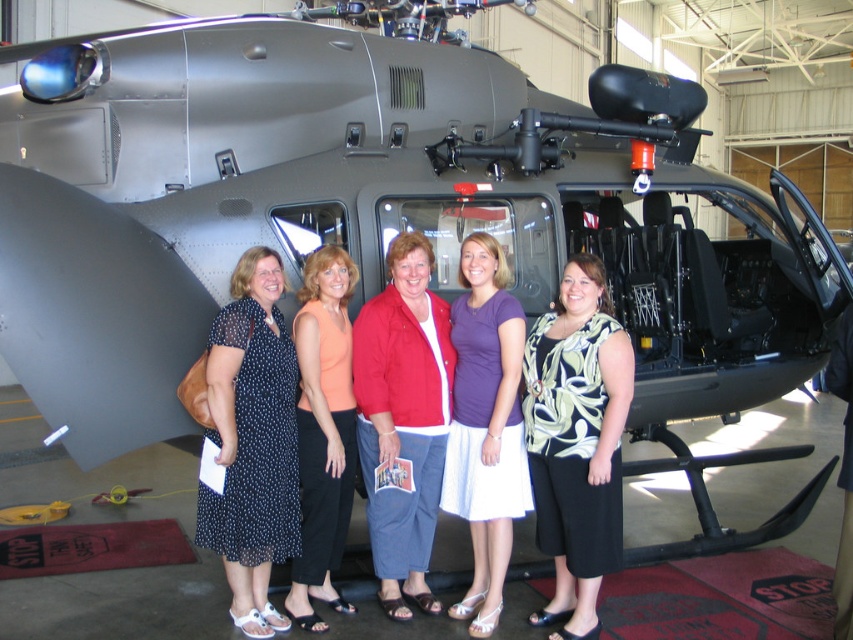
You are organizing a photoshoot and need to arrange the models so that the polka dot dress at center and orange fabric top at center are visible. Given their sizes, which model should be placed closer to the camera to ensure both are fully visible?

The polka dot dress at center is wider than the orange fabric top at center, so the orange fabric top at center should be placed closer to the camera to ensure both are fully visible.

You are standing in the hangar and want to find the polka dot dress at center. According to the coordinates provided, where should you look relative to the helicopter?

The polka dot dress at center is located at point coordinates, so you should look towards the center area of the image where the coordinates indicate its position relative to the helicopter.

You are a photographer setting up for a group photo in the hangar. You need to position yourself so that the floral print blouse at center and the purple cotton shirt at center are both in frame. Based on their positions, which direction should you face to ensure both are visible?

You should face to the left of the purple cotton shirt at center to include both the floral print blouse at center and the purple cotton shirt at center in your frame, since the floral print blouse at center is positioned to the right of the purple cotton shirt at center.